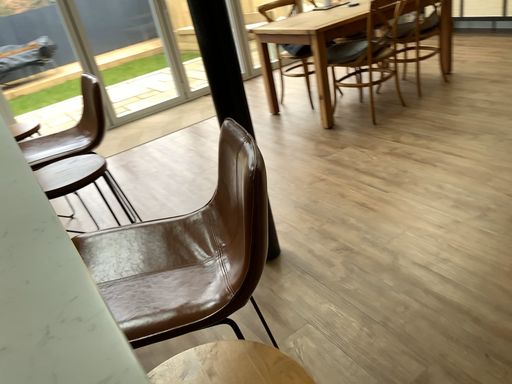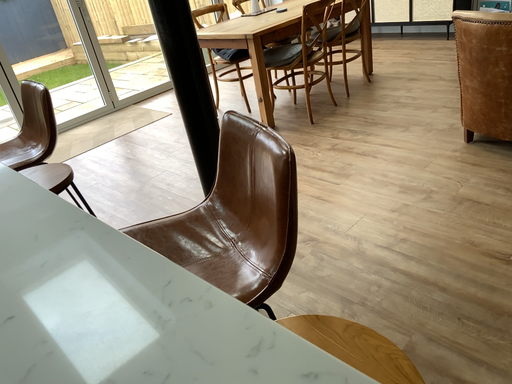
Question: Which way did the camera rotate in the video?

Choices:
 (A) rotated right
 (B) rotated left

Answer: (A)